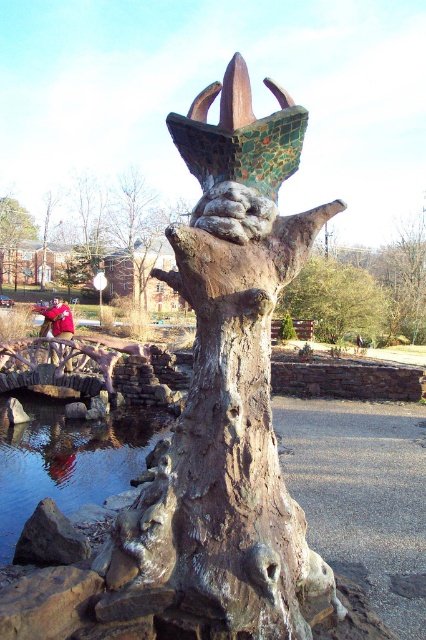
Question: Is rusty metal sculpture at center smaller than green mosaic tree at upper center?

Choices:
 (A) yes
 (B) no

Answer: (A)

Question: Which of the following is the farthest from the observer?

Choices:
 (A) (14, 204)
 (B) (344, 333)
 (C) (261, 636)

Answer: (A)

Question: Which point appears closest to the camera in this image?

Choices:
 (A) (336, 333)
 (B) (382, 339)

Answer: (A)

Question: Which object appears farthest from the camera in this image?

Choices:
 (A) green matte tree at lower left
 (B) rusty metal sculpture at center
 (C) matte red head at center

Answer: (A)

Question: In this image, where is green mosaic tree at upper center located relative to green matte tree at lower left?

Choices:
 (A) below
 (B) above

Answer: (A)

Question: Does rusty metal sculpture at center have a larger size compared to green mosaic tree at upper center?

Choices:
 (A) no
 (B) yes

Answer: (A)